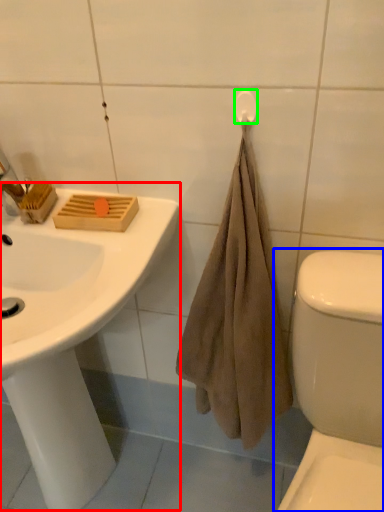
Question: Which is farther away from sink (highlighted by a red box)? toilet (highlighted by a blue box) or towel bar (highlighted by a green box)?

Choices:
 (A) toilet
 (B) towel bar

Answer: (B)